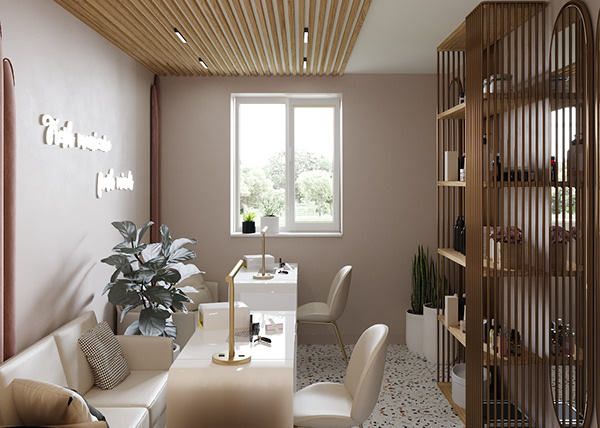
The image size is (600, 428). What are the coordinates of `potted plant` in the screenshot? It's located at (150, 322), (413, 304), (430, 292), (270, 215), (245, 218), (513, 237), (565, 237).